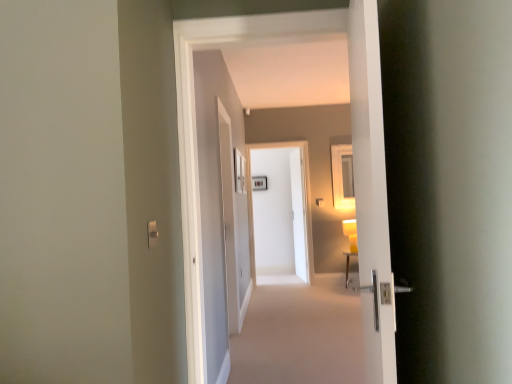
Question: Does white glossy door handle at right have a smaller size compared to white glossy door at center, which appears as the second door when viewed from the front?

Choices:
 (A) yes
 (B) no

Answer: (B)

Question: Is the position of white glossy door handle at right more distant than that of white glossy door at center, which appears as the second door when viewed from the front?

Choices:
 (A) no
 (B) yes

Answer: (A)

Question: Considering the relative positions of white glossy door handle at right and white glossy door at center, the first door viewed from the back, in the image provided, is white glossy door handle at right to the left of white glossy door at center, the first door viewed from the back, from the viewer's perspective?

Choices:
 (A) no
 (B) yes

Answer: (A)

Question: Considering the relative sizes of white glossy door handle at right and white glossy door at center, which appears as the second door when viewed from the front, in the image provided, is white glossy door handle at right bigger than white glossy door at center, which appears as the second door when viewed from the front,?

Choices:
 (A) no
 (B) yes

Answer: (B)

Question: Does white glossy door handle at right contain white glossy door at center, the first door viewed from the back?

Choices:
 (A) no
 (B) yes

Answer: (A)

Question: From a real-world perspective, is white glossy door handle at right physically above white glossy door at center, the first door viewed from the back?

Choices:
 (A) no
 (B) yes

Answer: (A)

Question: From the image's perspective, is yellow matte lamp at right located above white glossy door at center, which is the 2th door from back to front?

Choices:
 (A) no
 (B) yes

Answer: (A)

Question: Is yellow matte lamp at right far away from white glossy door at center, which is the 2th door from back to front?

Choices:
 (A) yes
 (B) no

Answer: (A)

Question: Is yellow matte lamp at right in contact with white glossy door at center, which is the 2th door from back to front?

Choices:
 (A) no
 (B) yes

Answer: (A)

Question: Does yellow matte lamp at right turn towards white glossy door at center, which is counted as the first door, starting from the front?

Choices:
 (A) no
 (B) yes

Answer: (B)

Question: Is yellow matte lamp at right wider than white glossy door at center, which is the 2th door from back to front?

Choices:
 (A) no
 (B) yes

Answer: (B)

Question: Is yellow matte lamp at right located outside white glossy door at center, which is counted as the first door, starting from the front?

Choices:
 (A) no
 (B) yes

Answer: (B)

Question: Does satin silver switch at lower left appear on the right side of white glossy door at center, which appears as the second door when viewed from the front?

Choices:
 (A) no
 (B) yes

Answer: (A)